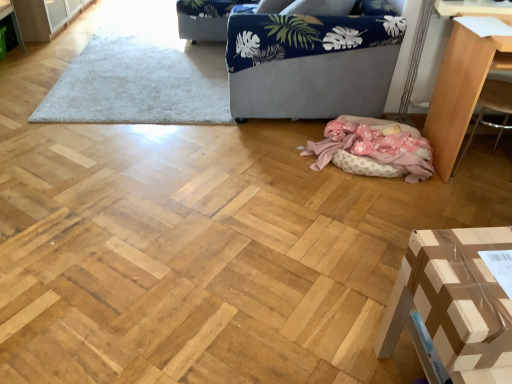
This screenshot has width=512, height=384. In order to click on brown cardboard box at lower right, marked as the 2th furniture in a back-to-front arrangement in this screenshot , I will do `click(455, 302)`.

The image size is (512, 384). Find the location of `light brown wood table at right, the first furniture viewed from the top`. light brown wood table at right, the first furniture viewed from the top is located at coordinates (461, 90).

Locate an element on the screen. armchair that is the 1st object above the pink polka dot fabric at lower center (from a real-world perspective) is located at coordinates click(492, 109).

Which is more to the right, pink polka dot fabric at lower center or wooden armchair at right, which appears as the second armchair when viewed from the left?

From the viewer's perspective, wooden armchair at right, which appears as the second armchair when viewed from the left, appears more on the right side.

Is pink polka dot fabric at lower center aimed at wooden armchair at right, arranged as the first armchair when viewed from the front?

No, pink polka dot fabric at lower center is not aimed at wooden armchair at right, arranged as the first armchair when viewed from the front.

Is pink polka dot fabric at lower center positioned in front of wooden armchair at right, arranged as the first armchair when viewed from the front?

No, pink polka dot fabric at lower center is further to the viewer.

Which point is more forward, (384, 172) or (453, 317)?

The point (453, 317) is in front.

Considering the sizes of objects pink polka dot fabric at lower center and brown cardboard box at lower right, which is counted as the second furniture, starting from the top, in the image provided, who is bigger, pink polka dot fabric at lower center or brown cardboard box at lower right, which is counted as the second furniture, starting from the top,?

With larger size is brown cardboard box at lower right, which is counted as the second furniture, starting from the top.

Does pink polka dot fabric at lower center have a greater height compared to brown cardboard box at lower right, marked as the 2th furniture in a back-to-front arrangement?

No.

The width and height of the screenshot is (512, 384). What are the coordinates of `armchair that is the 2nd one when counting backward from the light brown wood table at right, which appears as the first furniture when viewed from the back` in the screenshot? It's located at (205, 18).

Is point (507, 42) positioned in front of point (191, 2)?

Yes, point (507, 42) is in front of point (191, 2).

Can you tell me how much light brown wood table at right, the first furniture viewed from the top, and blue fabric armchair at upper center, placed as the 2th armchair when sorted from right to left, differ in facing direction?

There is a 0.511-degree angle between the facing directions of light brown wood table at right, the first furniture viewed from the top, and blue fabric armchair at upper center, placed as the 2th armchair when sorted from right to left.

Does light brown wood table at right, positioned as the second furniture in bottom-to-top order, have a larger size compared to blue fabric armchair at upper center, which ranks as the second armchair in bottom-to-top order?

No.

In the image, is brown cardboard box at lower right, which is counted as the first furniture, starting from the bottom, positioned in front of or behind light brown wood table at right, marked as the second furniture in a front-to-back arrangement?

Clearly, brown cardboard box at lower right, which is counted as the first furniture, starting from the bottom, is in front of light brown wood table at right, marked as the second furniture in a front-to-back arrangement.

Which is more to the left, brown cardboard box at lower right, the first furniture from the left, or light brown wood table at right, the first furniture viewed from the top?

From the viewer's perspective, brown cardboard box at lower right, the first furniture from the left, appears more on the left side.

Considering the relative sizes of brown cardboard box at lower right, the first furniture from the front, and light brown wood table at right, which appears as the first furniture when viewed from the right, in the image provided, is brown cardboard box at lower right, the first furniture from the front, thinner than light brown wood table at right, which appears as the first furniture when viewed from the right,?

Indeed, brown cardboard box at lower right, the first furniture from the front, has a lesser width compared to light brown wood table at right, which appears as the first furniture when viewed from the right.

From the picture: From the image's perspective, between brown cardboard box at lower right, marked as the 2th furniture in a back-to-front arrangement, and light brown wood table at right, the second furniture viewed from the left, which one is located above?

light brown wood table at right, the second furniture viewed from the left, appears higher in the image.

Does point (358, 89) come in front of point (510, 307)?

No, it is behind (510, 307).

Do you think navy blue fabric couch at upper center is within brown cardboard box at lower right, marked as the 2th furniture in a back-to-front arrangement, or outside of it?

navy blue fabric couch at upper center is outside brown cardboard box at lower right, marked as the 2th furniture in a back-to-front arrangement.

Is navy blue fabric couch at upper center in front of or behind brown cardboard box at lower right, the first furniture from the front, in the image?

In the image, navy blue fabric couch at upper center appears behind brown cardboard box at lower right, the first furniture from the front.

Does light brown wood table at right, which appears as the first furniture when viewed from the back, have a larger size compared to pink polka dot fabric at lower center?

Yes.

Based on the photo, from a real-world perspective, is light brown wood table at right, marked as the second furniture in a front-to-back arrangement, positioned above or below pink polka dot fabric at lower center?

light brown wood table at right, marked as the second furniture in a front-to-back arrangement, is situated higher than pink polka dot fabric at lower center in the real world.

Would you consider light brown wood table at right, which appears as the first furniture when viewed from the back, to be distant from pink polka dot fabric at lower center?

No, light brown wood table at right, which appears as the first furniture when viewed from the back, is in close proximity to pink polka dot fabric at lower center.

Does light brown wood table at right, marked as the second furniture in a front-to-back arrangement, turn towards pink polka dot fabric at lower center?

No, light brown wood table at right, marked as the second furniture in a front-to-back arrangement, is not oriented towards pink polka dot fabric at lower center.

Is white shaggy rug at upper center bigger than blue fabric armchair at upper center, positioned as the first armchair in back-to-front order?

No.

Are white shaggy rug at upper center and blue fabric armchair at upper center, the 1th armchair when ordered from left to right, making contact?

There is a gap between white shaggy rug at upper center and blue fabric armchair at upper center, the 1th armchair when ordered from left to right.

Is white shaggy rug at upper center further to the viewer compared to blue fabric armchair at upper center, which ranks as the second armchair in bottom-to-top order?

No, it is not.

Locate an element on the screen. The width and height of the screenshot is (512, 384). the 2nd armchair directly above the white shaggy rug at upper center (from a real-world perspective) is located at coordinates (205, 18).

The height and width of the screenshot is (384, 512). I want to click on blanket below the wooden armchair at right, which appears as the second armchair when viewed from the left (from the image's perspective), so click(x=373, y=148).

Locate an element on the screen. The width and height of the screenshot is (512, 384). blanket that appears above the brown cardboard box at lower right, marked as the 2th furniture in a back-to-front arrangement (from the image's perspective) is located at coordinates (373, 148).

Considering their positions, is navy blue fabric couch at upper center positioned further to light brown wood table at right, the first furniture viewed from the top, than brown cardboard box at lower right, which is counted as the 2th furniture, starting from the right?

brown cardboard box at lower right, which is counted as the 2th furniture, starting from the right, lies further to light brown wood table at right, the first furniture viewed from the top, than the other object.

Considering their positions, is light brown wood table at right, positioned as the second furniture in bottom-to-top order, positioned further to white shaggy rug at upper center than brown cardboard box at lower right, marked as the 2th furniture in a back-to-front arrangement?

brown cardboard box at lower right, marked as the 2th furniture in a back-to-front arrangement, is positioned further to the anchor white shaggy rug at upper center.

Looking at the image, which one is located closer to navy blue fabric couch at upper center, wooden armchair at right, arranged as the second armchair when viewed from the back, or blue fabric armchair at upper center, which is the 2th armchair from front to back?

wooden armchair at right, arranged as the second armchair when viewed from the back, is positioned closer to the anchor navy blue fabric couch at upper center.

Considering their positions, is navy blue fabric couch at upper center positioned closer to pink polka dot fabric at lower center than brown cardboard box at lower right, the first furniture from the left?

The object closer to pink polka dot fabric at lower center is navy blue fabric couch at upper center.

Considering their positions, is pink polka dot fabric at lower center positioned further to light brown wood table at right, which appears as the first furniture when viewed from the right, than blue fabric armchair at upper center, the first armchair viewed from the top?

blue fabric armchair at upper center, the first armchair viewed from the top, lies further to light brown wood table at right, which appears as the first furniture when viewed from the right, than the other object.

Based on the photo, considering their positions, is white shaggy rug at upper center positioned further to navy blue fabric couch at upper center than light brown wood table at right, the first furniture viewed from the top?

white shaggy rug at upper center lies further to navy blue fabric couch at upper center than the other object.

In the scene shown: When comparing their distances from white shaggy rug at upper center, does light brown wood table at right, positioned as the second furniture in bottom-to-top order, or pink polka dot fabric at lower center seem further?

light brown wood table at right, positioned as the second furniture in bottom-to-top order, lies further to white shaggy rug at upper center than the other object.

Looking at the image, which one is located further to pink polka dot fabric at lower center, blue fabric armchair at upper center, which ranks as the second armchair in bottom-to-top order, or light brown wood table at right, the second furniture viewed from the left?

The object further to pink polka dot fabric at lower center is blue fabric armchair at upper center, which ranks as the second armchair in bottom-to-top order.

At what (x,y) coordinates should I click in order to perform the action: click on blanket between brown cardboard box at lower right, which is counted as the second furniture, starting from the top, and white shaggy rug at upper center in the front-back direction. Please return your answer as a coordinate pair (x, y). Looking at the image, I should click on (373, 148).

What are the coordinates of `mat between navy blue fabric couch at upper center and brown cardboard box at lower right, which is counted as the 2th furniture, starting from the right, vertically` in the screenshot? It's located at (141, 81).

You are a GUI agent. You are given a task and a screenshot of the screen. Output one action in this format:
    pyautogui.click(x=<x>, y=<y>)
    Task: Click on the armchair located between pink polka dot fabric at lower center and light brown wood table at right, the first furniture viewed from the top, in the left-right direction
    
    Given the screenshot: What is the action you would take?
    pyautogui.click(x=492, y=109)

At what (x,y) coordinates should I click in order to perform the action: click on blanket between light brown wood table at right, marked as the second furniture in a front-to-back arrangement, and blue fabric armchair at upper center, the 1th armchair when ordered from left to right, in the front-back direction. Please return your answer as a coordinate pair (x, y). The width and height of the screenshot is (512, 384). Looking at the image, I should click on (373, 148).